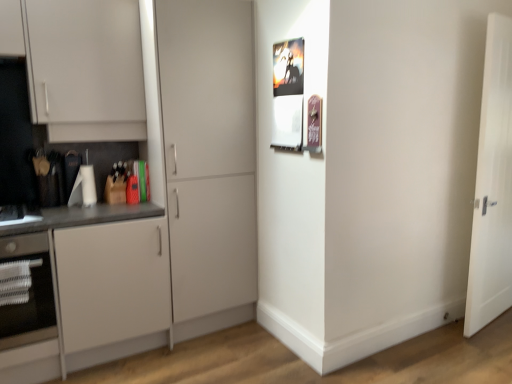
Measure the distance between point [211,263] and camera.

Point [211,263] and camera are 2.71 meters apart.

What do you see at coordinates (492, 186) in the screenshot? I see `white wooden door at right, marked as the 2th door in a left-to-right arrangement` at bounding box center [492, 186].

Identify the location of matte white cabinet at center, which ranks as the first door in left-to-right order. (208, 151).

In the scene shown: Between matte white cabinet at center, arranged as the 2th door when viewed from the right, and white glossy oven at lower left, which one has larger size?

Bigger between the two is matte white cabinet at center, arranged as the 2th door when viewed from the right.

Is matte white cabinet at center, which ranks as the first door in left-to-right order, to the left or to the right of white glossy oven at lower left in the image?

Based on their positions, matte white cabinet at center, which ranks as the first door in left-to-right order, is located to the right of white glossy oven at lower left.

Is matte white cabinet at center, which ranks as the first door in left-to-right order, shorter than white glossy oven at lower left?

In fact, matte white cabinet at center, which ranks as the first door in left-to-right order, may be taller than white glossy oven at lower left.

Does white glossy oven at lower left touch matte white cabinet at center, which ranks as the first door in left-to-right order?

No, white glossy oven at lower left is not making contact with matte white cabinet at center, which ranks as the first door in left-to-right order.

Choose the correct answer: Is white glossy oven at lower left inside matte white cabinet at center, which ranks as the first door in left-to-right order, or outside it?

white glossy oven at lower left is spatially situated outside matte white cabinet at center, which ranks as the first door in left-to-right order.

Is point (20, 259) behind point (165, 140)?

No, (20, 259) is closer to viewer.

Is white glossy oven at lower left looking in the opposite direction of matte white cabinet at center, arranged as the 2th door when viewed from the right?

white glossy oven at lower left is not turned away from matte white cabinet at center, arranged as the 2th door when viewed from the right.

Based on the photo, can you confirm if white wooden door at right, which is the first door from right to left, is positioned to the right of white matte cabinet at left?

Yes, white wooden door at right, which is the first door from right to left, is to the right of white matte cabinet at left.

Considering the positions of point (499, 171) and point (34, 236), is point (499, 171) closer or farther from the camera than point (34, 236)?

Clearly, point (499, 171) is more distant from the camera than point (34, 236).

Looking at this image, which is correct: white wooden door at right, which is the first door from right to left, is inside white matte cabinet at left, or outside of it?

white wooden door at right, which is the first door from right to left, lies outside white matte cabinet at left.

Is white wooden door at right, marked as the 2th door in a left-to-right arrangement, far away from white glossy oven at lower left?

Yes, white wooden door at right, marked as the 2th door in a left-to-right arrangement, and white glossy oven at lower left are quite far apart.

Does point (492, 120) appear closer or farther from the camera than point (34, 255)?

Point (492, 120) is farther from the camera than point (34, 255).

From a real-world perspective, is white wooden door at right, which is the first door from right to left, above or below white glossy oven at lower left?

From a real-world perspective, white wooden door at right, which is the first door from right to left, is physically above white glossy oven at lower left.

Considering the sizes of objects white wooden door at right, which is the first door from right to left, and white glossy oven at lower left in the image provided, who is wider, white wooden door at right, which is the first door from right to left, or white glossy oven at lower left?

Wider between the two is white glossy oven at lower left.

Is point (95, 214) closer to viewer compared to point (5, 334)?

No.

In the image, is white matte cabinet at left positioned in front of or behind white glossy oven at lower left?

In the image, white matte cabinet at left appears in front of white glossy oven at lower left.

From a real-world perspective, is white matte cabinet at left located beneath white glossy oven at lower left?

Yes, from a real-world perspective, white matte cabinet at left is below white glossy oven at lower left.

Consider the image. Between white matte cabinet at left and white glossy oven at lower left, which one has less height?

white glossy oven at lower left is shorter.

This screenshot has height=384, width=512. In order to click on door behind the matte white cabinet at center, which ranks as the first door in left-to-right order in this screenshot , I will do `click(492, 186)`.

Is matte white cabinet at center, arranged as the 2th door when viewed from the right, not near white wooden door at right, marked as the 2th door in a left-to-right arrangement?

Indeed, matte white cabinet at center, arranged as the 2th door when viewed from the right, is not near white wooden door at right, marked as the 2th door in a left-to-right arrangement.

Which is closer to the camera, (158, 72) or (496, 42)?

The point (158, 72) is in front.

In the scene shown: From a real-world perspective, is matte white cabinet at center, arranged as the 2th door when viewed from the right, under white wooden door at right, marked as the 2th door in a left-to-right arrangement?

No, from a real-world perspective, matte white cabinet at center, arranged as the 2th door when viewed from the right, is not beneath white wooden door at right, marked as the 2th door in a left-to-right arrangement.

From a real-world perspective, which is physically below, white matte cabinet at left or matte white cabinet at center, which ranks as the first door in left-to-right order?

From a 3D spatial view, white matte cabinet at left is below.

Is white matte cabinet at left turned away from matte white cabinet at center, which ranks as the first door in left-to-right order?

No.

Is point (86, 220) farther from viewer compared to point (184, 264)?

No, it is not.

Find the location of a particular element. This screenshot has height=384, width=512. oven below the matte white cabinet at center, arranged as the 2th door when viewed from the right (from the image's perspective) is located at coordinates (29, 293).

Where is `oven lying on the left of matte white cabinet at center, arranged as the 2th door when viewed from the right`? This screenshot has width=512, height=384. oven lying on the left of matte white cabinet at center, arranged as the 2th door when viewed from the right is located at coordinates (29, 293).

Based on their spatial positions, is white matte cabinet at left or white glossy oven at lower left closer to matte white cabinet at center, which ranks as the first door in left-to-right order?

Among the two, white matte cabinet at left is located nearer to matte white cabinet at center, which ranks as the first door in left-to-right order.

From the image, which object appears to be farther from white glossy oven at lower left, white wooden door at right, which is the first door from right to left, or white matte cabinet at left?

white wooden door at right, which is the first door from right to left, is positioned further to the anchor white glossy oven at lower left.

Looking at the image, which one is located closer to white wooden door at right, which is the first door from right to left, matte white cabinet at center, which ranks as the first door in left-to-right order, or white matte cabinet at left?

matte white cabinet at center, which ranks as the first door in left-to-right order, lies closer to white wooden door at right, which is the first door from right to left, than the other object.

Which object lies nearer to the anchor point white glossy oven at lower left, white matte cabinet at left or matte white cabinet at center, which ranks as the first door in left-to-right order?

white matte cabinet at left is positioned closer to the anchor white glossy oven at lower left.

From the picture: Looking at the image, which one is located closer to white glossy oven at lower left, matte white cabinet at center, arranged as the 2th door when viewed from the right, or white wooden door at right, which is the first door from right to left?

matte white cabinet at center, arranged as the 2th door when viewed from the right.

Estimate the real-world distances between objects in this image. Which object is closer to white wooden door at right, which is the first door from right to left, white glossy oven at lower left or matte white cabinet at center, arranged as the 2th door when viewed from the right?

matte white cabinet at center, arranged as the 2th door when viewed from the right, is positioned closer to the anchor white wooden door at right, which is the first door from right to left.

From the image, which object appears to be nearer to white glossy oven at lower left, matte white cabinet at center, which ranks as the first door in left-to-right order, or white matte cabinet at left?

white matte cabinet at left is positioned closer to the anchor white glossy oven at lower left.

From the image, which object appears to be farther from matte white cabinet at center, which ranks as the first door in left-to-right order, white wooden door at right, marked as the 2th door in a left-to-right arrangement, or white matte cabinet at left?

Among the two, white wooden door at right, marked as the 2th door in a left-to-right arrangement, is located further to matte white cabinet at center, which ranks as the first door in left-to-right order.

Find the location of `cabinetry between white glossy oven at lower left and matte white cabinet at center, arranged as the 2th door when viewed from the right`. cabinetry between white glossy oven at lower left and matte white cabinet at center, arranged as the 2th door when viewed from the right is located at coordinates (97, 276).

This screenshot has width=512, height=384. I want to click on door between white matte cabinet at left and white wooden door at right, which is the first door from right to left, so click(208, 151).

At what (x,y) coordinates should I click in order to perform the action: click on cabinetry located between white glossy oven at lower left and white wooden door at right, marked as the 2th door in a left-to-right arrangement, in the left-right direction. Please return your answer as a coordinate pair (x, y). Image resolution: width=512 pixels, height=384 pixels. Looking at the image, I should click on (97, 276).

You are a GUI agent. You are given a task and a screenshot of the screen. Output one action in this format:
    pyautogui.click(x=<x>, y=<y>)
    Task: Click on the door between white glossy oven at lower left and white wooden door at right, which is the first door from right to left
    This screenshot has height=384, width=512.
    Given the screenshot: What is the action you would take?
    pyautogui.click(x=208, y=151)